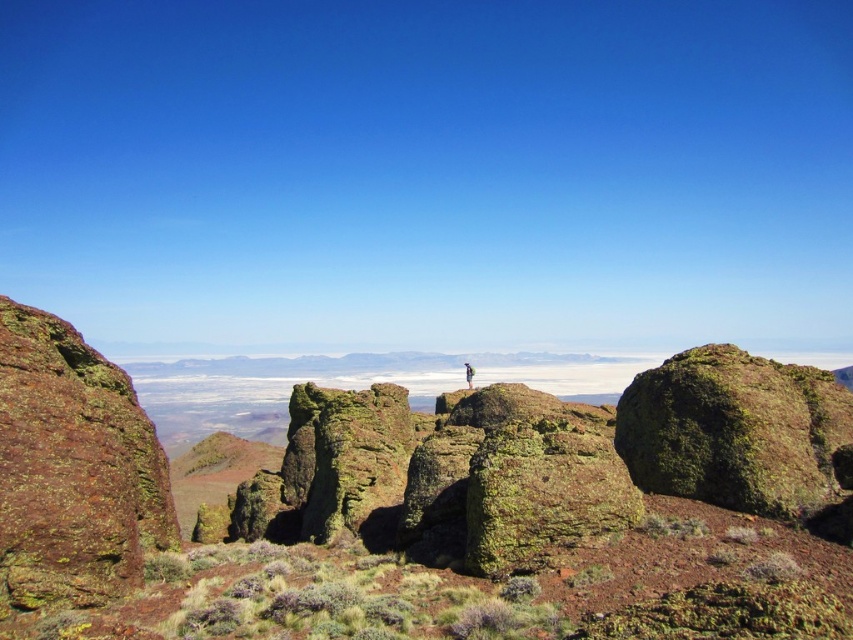
You are standing at the origin point of the coordinate system in this landscape. You need to locate the green mossy rock at center. What are its coordinates?

The green mossy rock at center is located at coordinates point [419,504].

You are standing at the point labeled as point (734, 429) in the image. Looking around, you see a green mossy rock at center right. What is the nearest object to your current position?

The nearest object to your current position is the green mossy rock at center right, as the point (734, 429) corresponds to it.